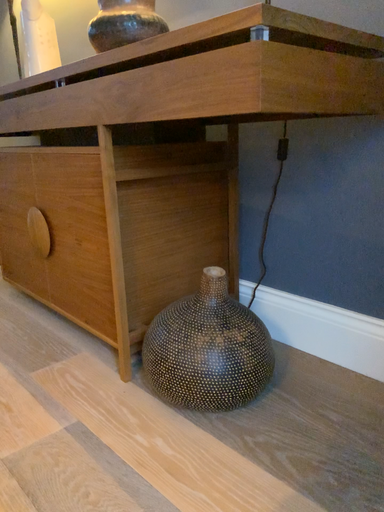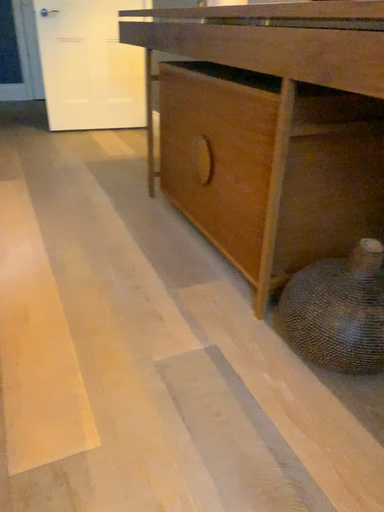
Question: Which way did the camera rotate in the video?

Choices:
 (A) rotated right
 (B) rotated left

Answer: (B)